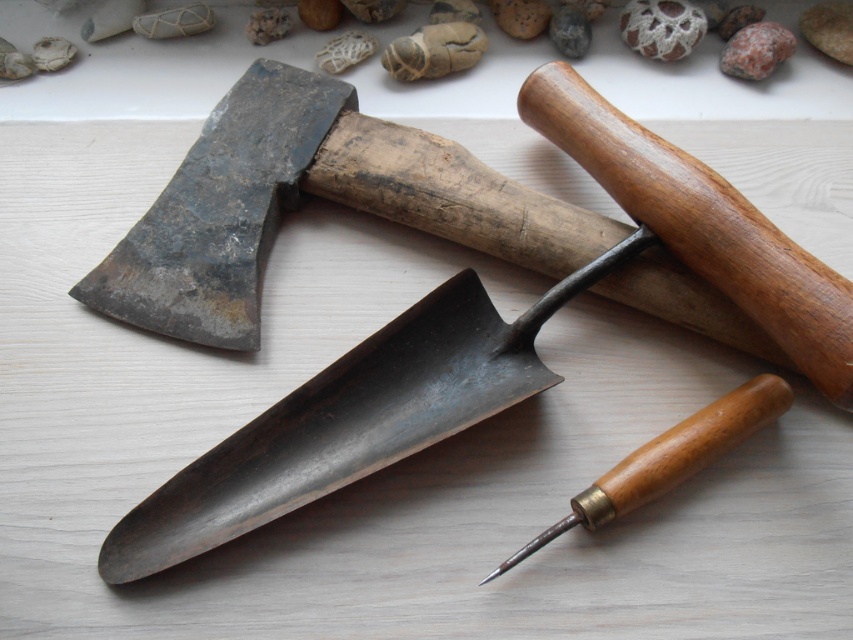
Question: Observing the image, what is the correct spatial positioning of smooth brown rock at upper center in reference to marble-like stone at upper center?

Choices:
 (A) below
 (B) above

Answer: (B)

Question: Among these points, which one is farthest from the camera?

Choices:
 (A) (759, 35)
 (B) (672, 440)

Answer: (A)

Question: Among these objects, which one is nearest to the camera?

Choices:
 (A) wooden handle chisel at lower right
 (B) smooth brown rock at upper center

Answer: (A)

Question: Can you confirm if wooden handle chisel at lower right is positioned below smooth brown rock at upper center?

Choices:
 (A) yes
 (B) no

Answer: (A)

Question: Which of the following is the farthest from the observer?

Choices:
 (A) (718, 67)
 (B) (636, 40)

Answer: (A)

Question: Can you confirm if wooden handle chisel at lower right is positioned to the right of smooth brown rock at upper center?

Choices:
 (A) no
 (B) yes

Answer: (A)